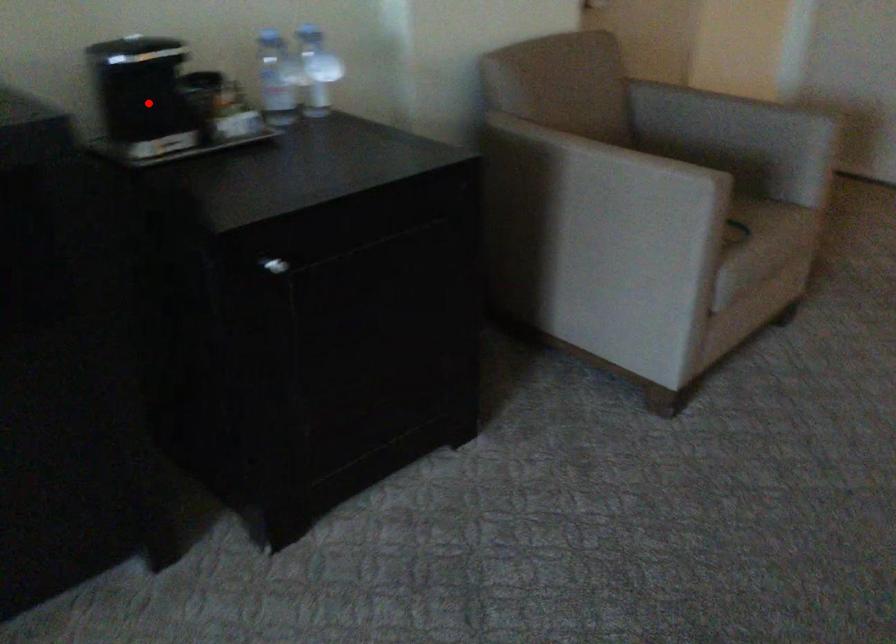
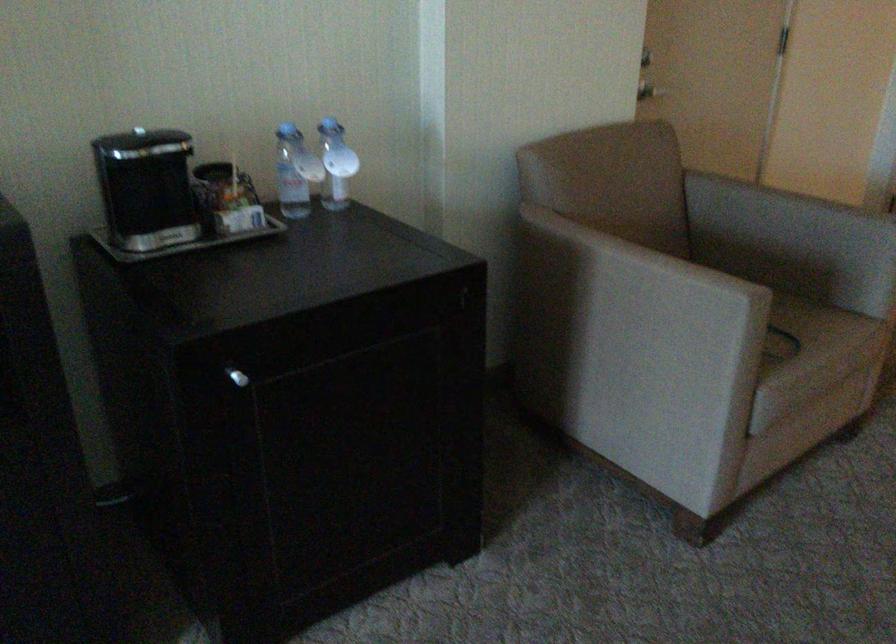
Locate, in the second image, the point that corresponds to the highlighted location in the first image.

(149, 194)